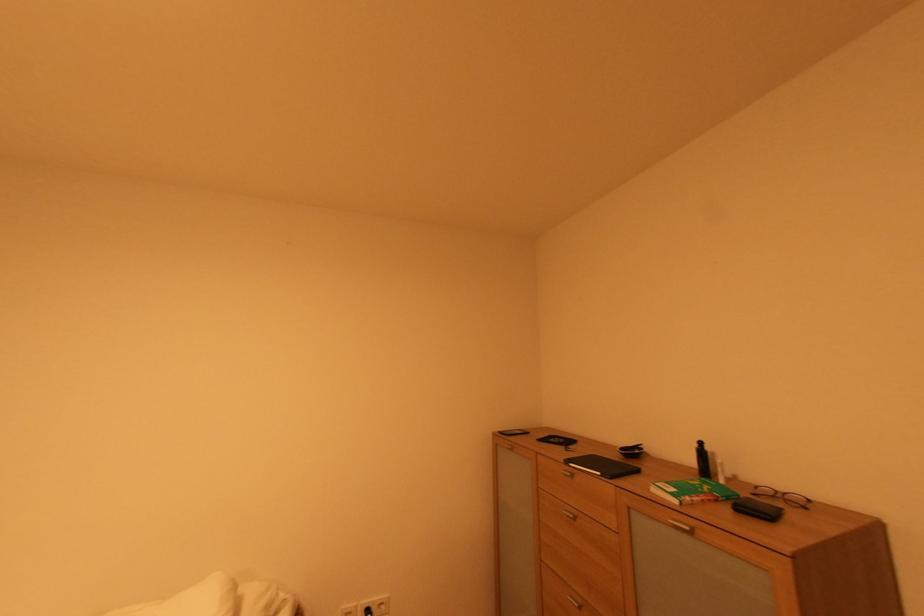
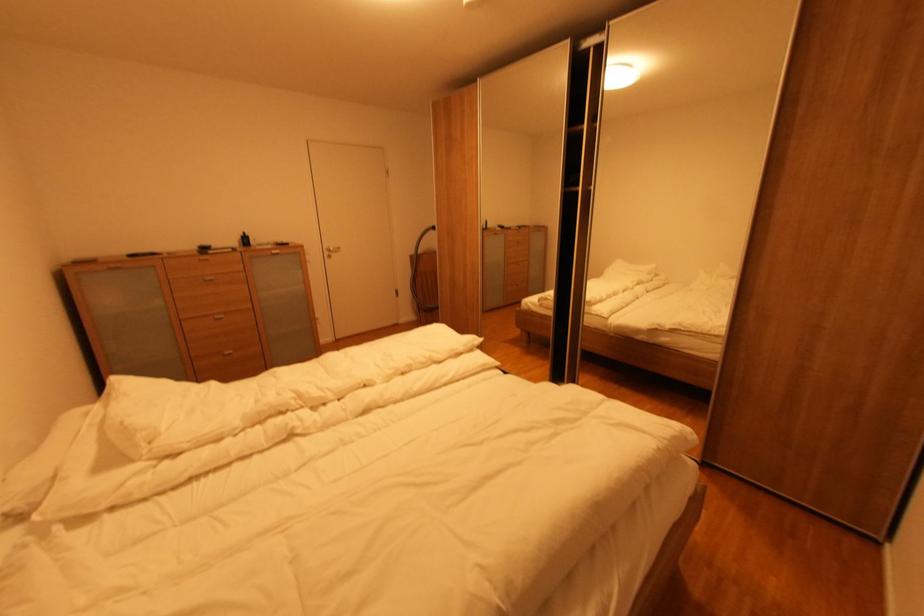
In the second image, find the point that corresponds to the point at 701,447 in the first image.

(248, 237)